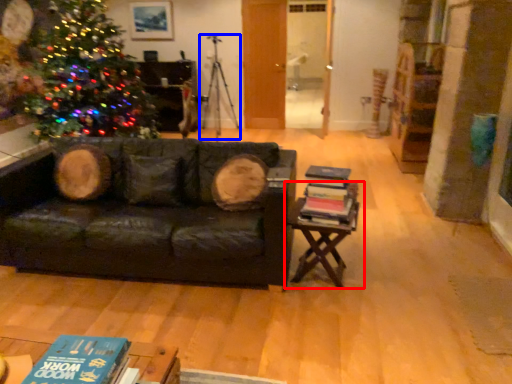
Question: Which object is closer to the camera taking this photo, table (highlighted by a red box) or tripod (highlighted by a blue box)?

Choices:
 (A) table
 (B) tripod

Answer: (A)